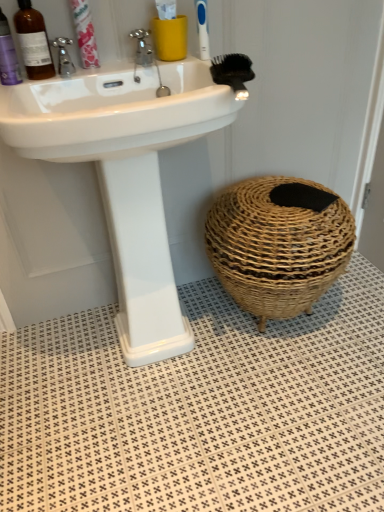
Question: Considering the relative sizes of matte yellow cup at upper center and black bristle brush at upper right in the image provided, is matte yellow cup at upper center smaller than black bristle brush at upper right?

Choices:
 (A) no
 (B) yes

Answer: (A)

Question: Considering the relative positions of matte yellow cup at upper center and black bristle brush at upper right in the image provided, is matte yellow cup at upper center to the right of black bristle brush at upper right from the viewer's perspective?

Choices:
 (A) yes
 (B) no

Answer: (B)

Question: From the image's perspective, is matte yellow cup at upper center located above black bristle brush at upper right?

Choices:
 (A) no
 (B) yes

Answer: (B)

Question: Is black bristle brush at upper right completely or partially inside matte yellow cup at upper center?

Choices:
 (A) no
 (B) yes

Answer: (A)

Question: Is matte yellow cup at upper center taller than black bristle brush at upper right?

Choices:
 (A) no
 (B) yes

Answer: (B)

Question: Is matte yellow cup at upper center facing towards black bristle brush at upper right?

Choices:
 (A) yes
 (B) no

Answer: (A)

Question: Is white glossy sink at upper center at the right side of blue plastic toothbrush at upper center?

Choices:
 (A) no
 (B) yes

Answer: (A)

Question: Is white glossy sink at upper center aimed at blue plastic toothbrush at upper center?

Choices:
 (A) no
 (B) yes

Answer: (A)

Question: From the image's perspective, is white glossy sink at upper center over blue plastic toothbrush at upper center?

Choices:
 (A) yes
 (B) no

Answer: (B)

Question: Is white glossy sink at upper center located outside blue plastic toothbrush at upper center?

Choices:
 (A) no
 (B) yes

Answer: (B)

Question: Considering the relative sizes of white glossy sink at upper center and blue plastic toothbrush at upper center in the image provided, is white glossy sink at upper center bigger than blue plastic toothbrush at upper center?

Choices:
 (A) no
 (B) yes

Answer: (B)

Question: Would you consider white glossy sink at upper center to be distant from blue plastic toothbrush at upper center?

Choices:
 (A) yes
 (B) no

Answer: (B)

Question: Can pink paper toothpaste at upper left be found inside brushed metal faucet at upper left, marked as the 2th tap in a right-to-left arrangement?

Choices:
 (A) no
 (B) yes

Answer: (A)